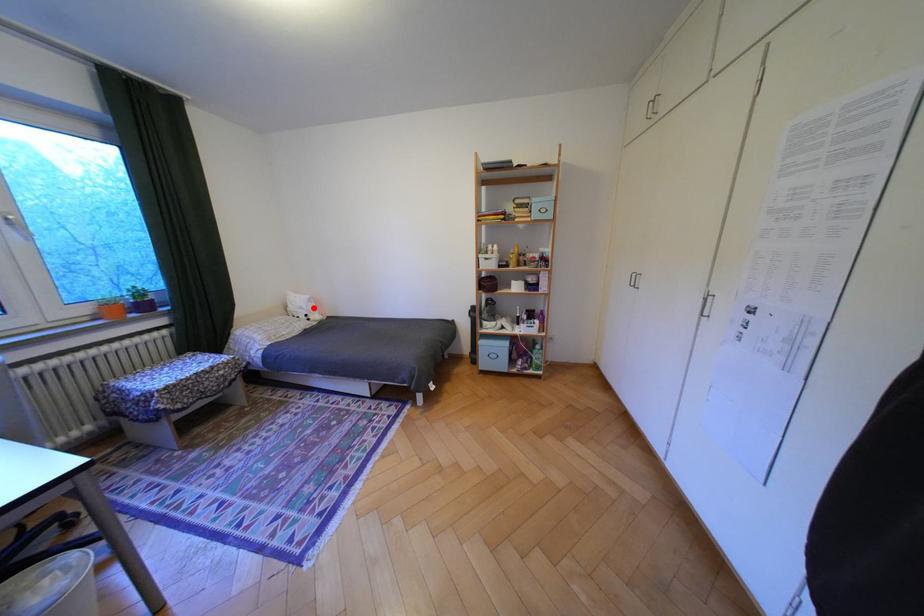
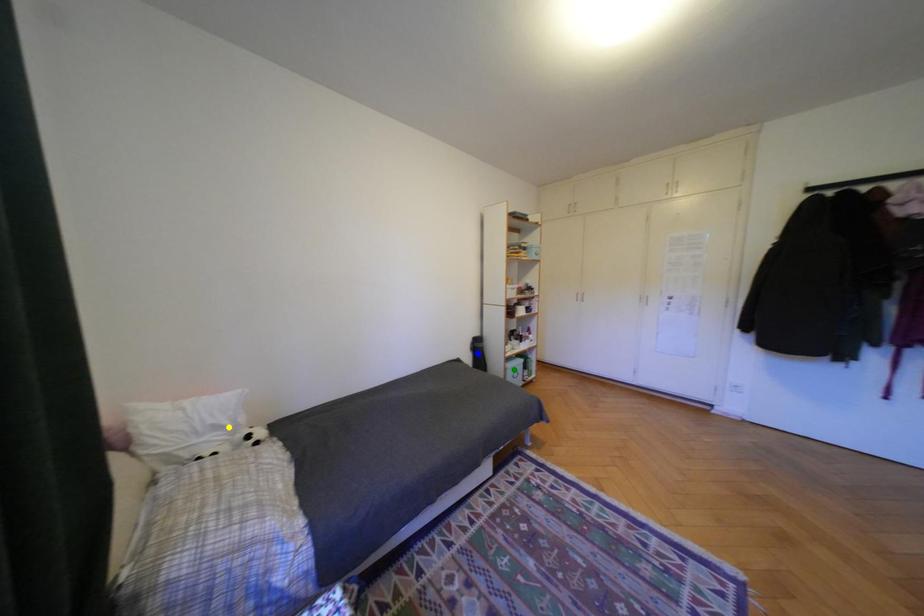
Question: I am providing you with two images of the same scene from different viewpoints. A red point is marked on the first image. You are given multiple points on the second image. Which spot in image 2 lines up with the point in image 1?

Choices:
 (A) blue point
 (B) green point
 (C) yellow point

Answer: (C)